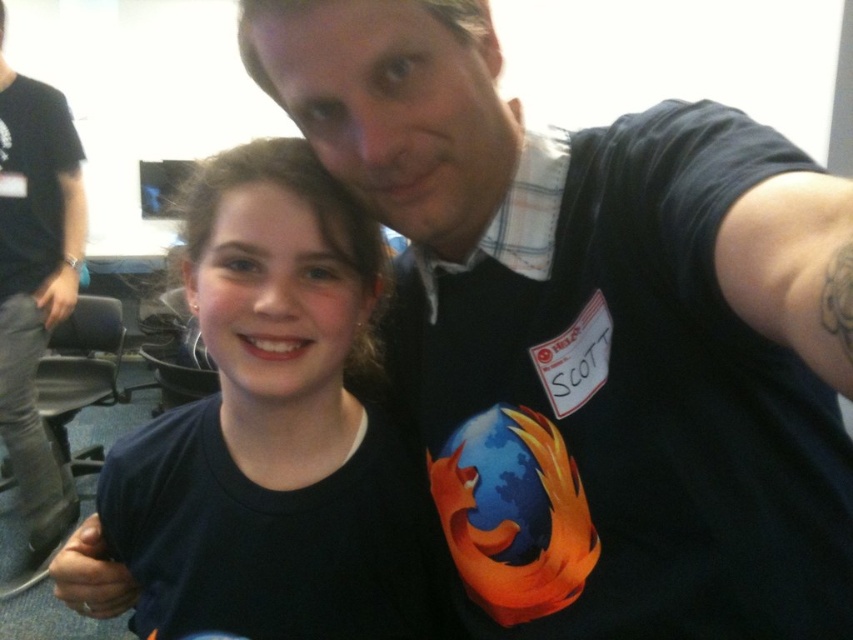
You are a photographer trying to focus on the plaid fabric shirt at upper center and the black fabric arm at left in the image. Which object is closer to the camera?

The plaid fabric shirt at upper center is closer to the camera because it is in front of the black fabric arm at left.